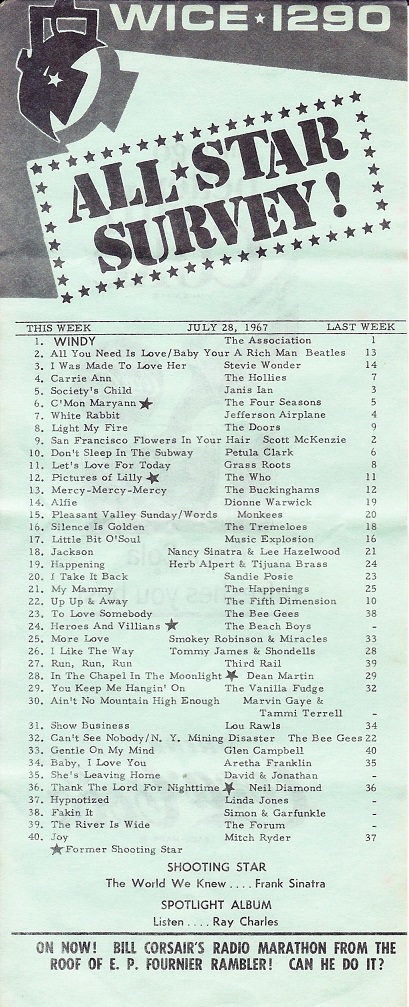
Find the location of `empty space right of stage light`. empty space right of stage light is located at coordinates (177, 89).